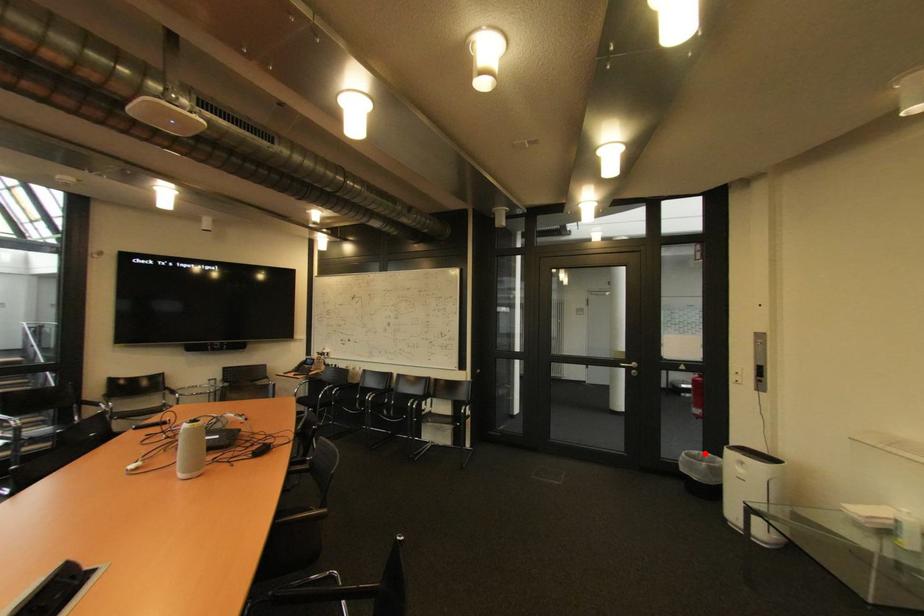
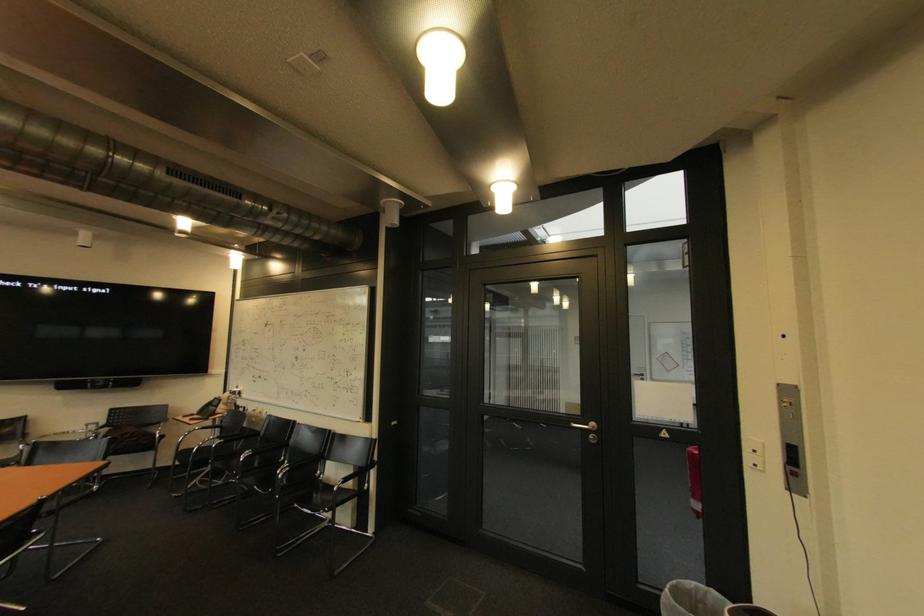
Question: I am providing you with two images of the same scene from different viewpoints. Image1 has a red point marked. In image2, the corresponding 3D location appears at what relative position? Reply with the corresponding letter.

Choices:
 (A) Closer
 (B) Farther

Answer: (B)